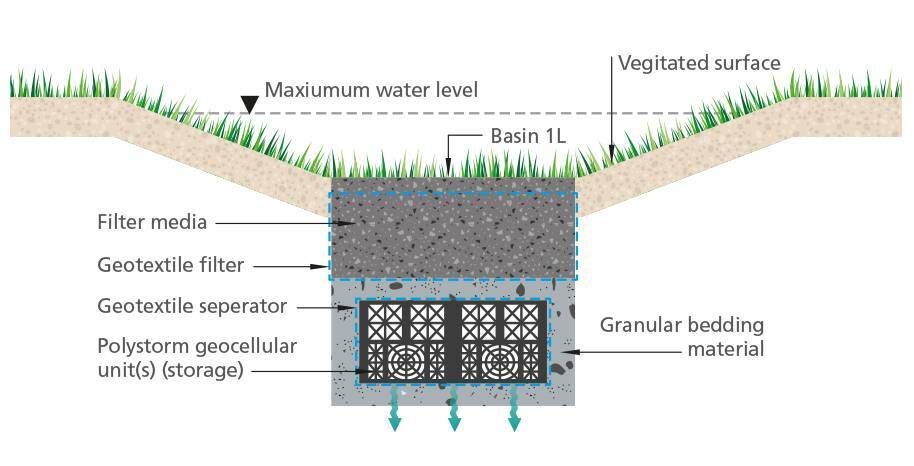
The height and width of the screenshot is (466, 914). What are the coordinates of `light gray surface` in the screenshot? It's located at (399, 283).